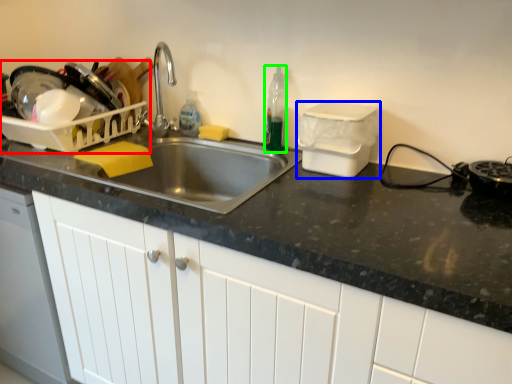
Question: Which object is positioned closest to appliance (highlighted by a red box)? Select from appliance (highlighted by a blue box) and bottle (highlighted by a green box).

Choices:
 (A) appliance
 (B) bottle

Answer: (B)